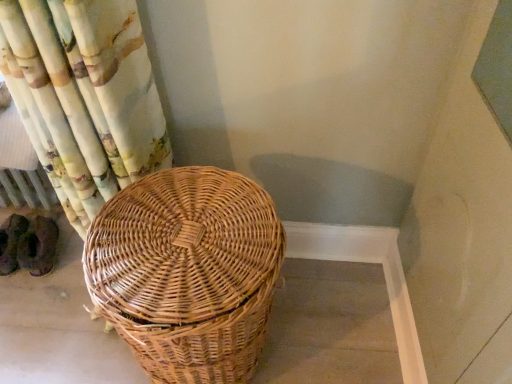
This screenshot has width=512, height=384. What are the coordinates of `vacant space to the right of woven brown picnic basket at center` in the screenshot? It's located at (329, 324).